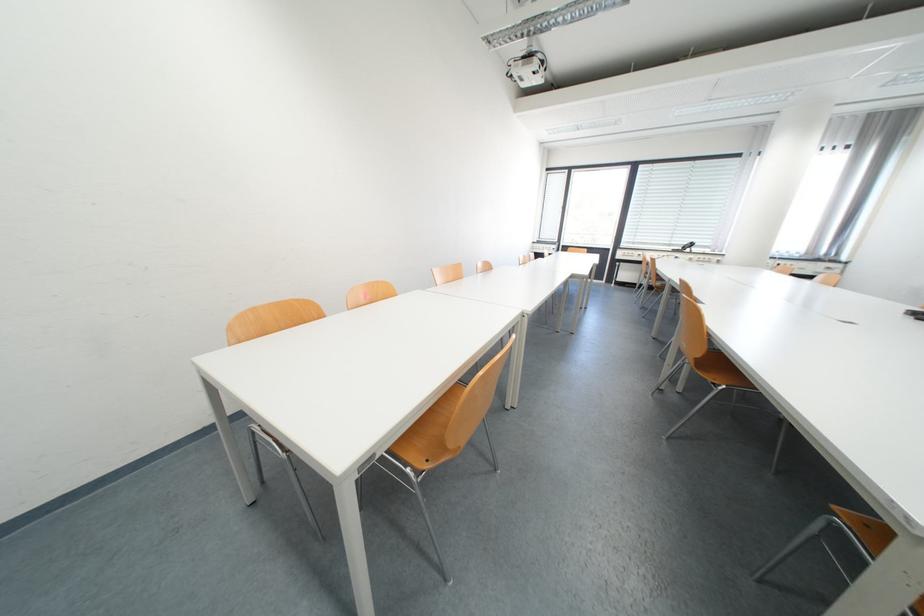
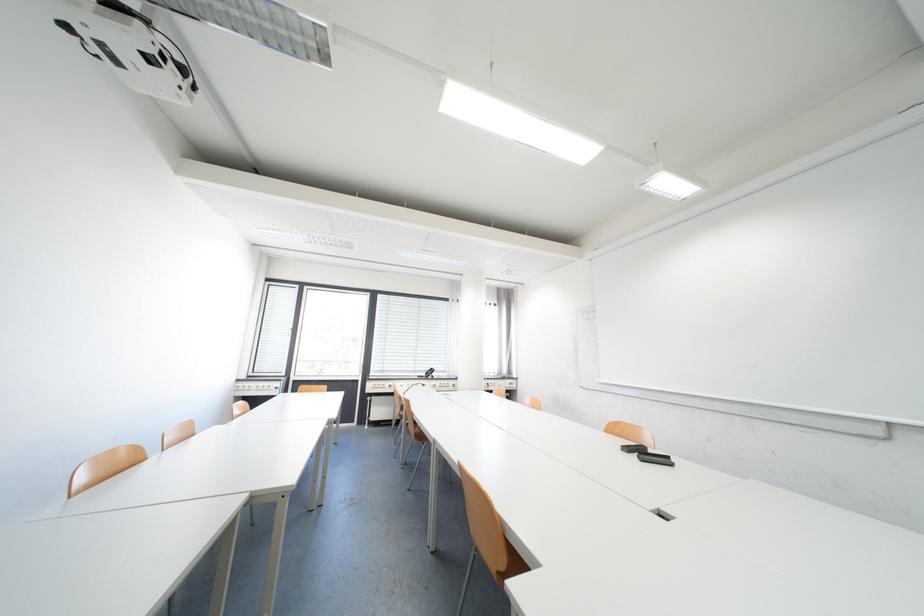
Locate, in the second image, the point that corresponds to the point at 679,246 in the first image.

(426, 371)